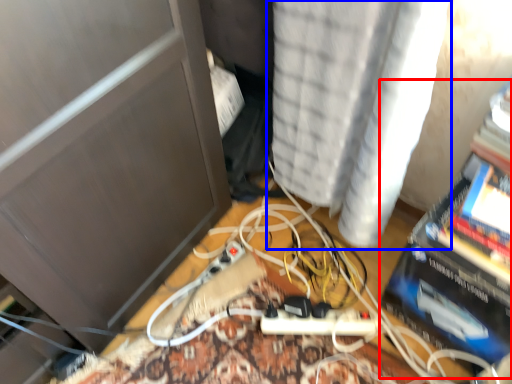
Question: Which of the following is the closest to the observer, paperback book (highlighted by a red box) or curtain (highlighted by a blue box)?

Choices:
 (A) paperback book
 (B) curtain

Answer: (B)